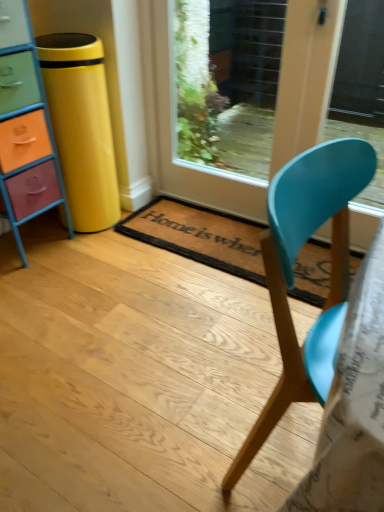
In order to click on vacant region in front of brown coir mat at center in this screenshot , I will do `click(179, 335)`.